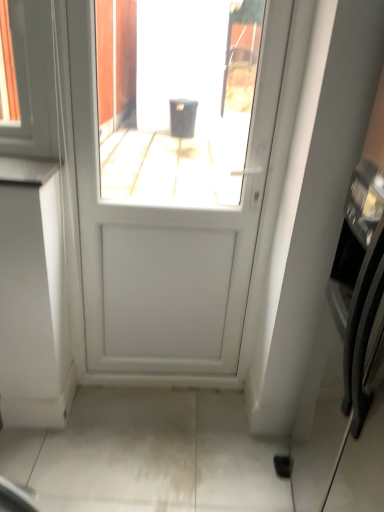
Question: Can you confirm if satin black oven at right is wider than white matte door at center?

Choices:
 (A) yes
 (B) no

Answer: (A)

Question: Is the position of satin black oven at right more distant than that of white matte door at center?

Choices:
 (A) yes
 (B) no

Answer: (B)

Question: Is satin black oven at right taller than white matte door at center?

Choices:
 (A) no
 (B) yes

Answer: (B)

Question: Is satin black oven at right not inside white matte door at center?

Choices:
 (A) no
 (B) yes

Answer: (B)

Question: Is satin black oven at right looking in the opposite direction of white matte door at center?

Choices:
 (A) no
 (B) yes

Answer: (A)

Question: From a real-world perspective, is satin black oven at right positioned over white matte door at center based on gravity?

Choices:
 (A) no
 (B) yes

Answer: (A)

Question: From the image's perspective, is white matte door at center beneath white glossy countertop at left?

Choices:
 (A) no
 (B) yes

Answer: (B)

Question: Is white matte door at center far away from white glossy countertop at left?

Choices:
 (A) no
 (B) yes

Answer: (A)

Question: Would you say white glossy countertop at left is part of white matte door at center's contents?

Choices:
 (A) yes
 (B) no

Answer: (B)

Question: Is white matte door at center next to white glossy countertop at left?

Choices:
 (A) yes
 (B) no

Answer: (B)

Question: Is white matte door at center bigger than white glossy countertop at left?

Choices:
 (A) yes
 (B) no

Answer: (A)

Question: Is white matte door at center turned away from white glossy countertop at left?

Choices:
 (A) yes
 (B) no

Answer: (B)

Question: Is satin black oven at right at the back of white glossy countertop at left?

Choices:
 (A) yes
 (B) no

Answer: (B)